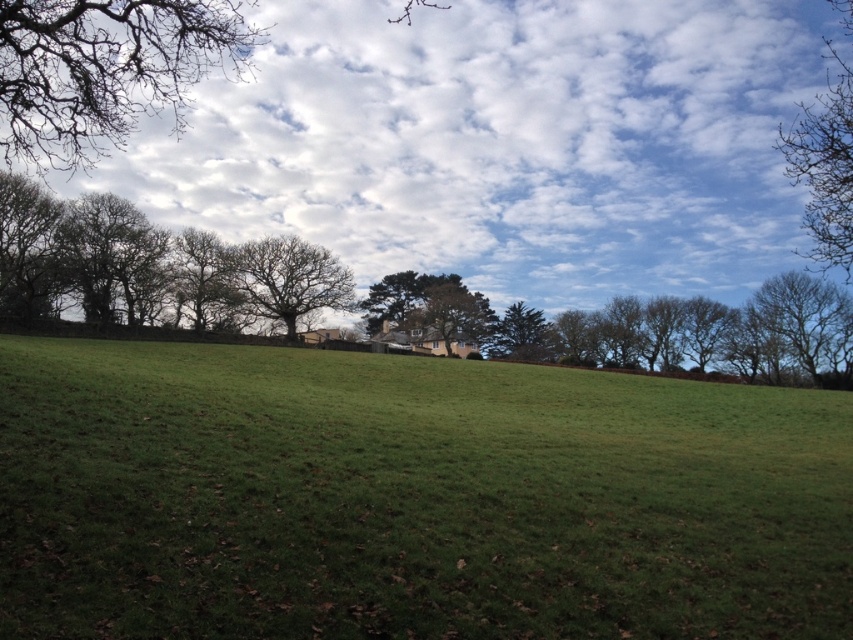
You are an artist painting this landscape and want to add a bird flying between the bare branches at upper left and the bare branches at upper right. Based on their positions, which direction should the bird fly to move from the closer branches to the farther ones?

The bird should fly towards the upper right because the bare branches at upper left are in front of the bare branches at upper right, meaning the ones at upper right are farther away.

You are standing in the middle of the green grassy field at center and want to walk towards the bare branches at upper left. Since the field is narrower than the branches, will you have enough space to walk around them without going into the grass?

The green grassy field at center is narrower than the bare branches at upper left, so you might not have enough space to walk around them without stepping into the grass.